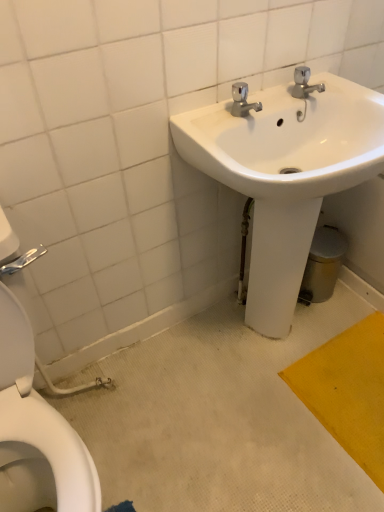
Measure the distance between white glossy sink at upper right and camera.

They are 34.95 inches apart.

This screenshot has height=512, width=384. In order to click on white glossy sink at upper right in this screenshot , I will do `click(286, 175)`.

What do you see at coordinates (286, 175) in the screenshot?
I see `white glossy sink at upper right` at bounding box center [286, 175].

Measure the distance between point (x=65, y=471) and camera.

The distance of point (x=65, y=471) from camera is 85.40 centimeters.

The width and height of the screenshot is (384, 512). In order to click on white glossy toilet at left in this screenshot , I will do `click(36, 431)`.

Describe the element at coordinates (36, 431) in the screenshot. I see `white glossy toilet at left` at that location.

I want to click on white glossy sink at upper right, so (286, 175).

Is white glossy toilet at left to the left of white glossy sink at upper right from the viewer's perspective?

Yes.

Which object is closer to the camera, white glossy toilet at left or white glossy sink at upper right?

white glossy toilet at left is closer to the camera.

Considering the points (63, 457) and (291, 226), which point is behind, point (63, 457) or point (291, 226)?

The point (291, 226) is farther.

From the image's perspective, is white glossy toilet at left located above white glossy sink at upper right?

Actually, white glossy toilet at left appears below white glossy sink at upper right in the image.

From a real-world perspective, between white glossy toilet at left and white glossy sink at upper right, who is vertically higher?

In real-world perspective, white glossy toilet at left is above.

In terms of width, does white glossy toilet at left look wider or thinner when compared to white glossy sink at upper right?

In the image, white glossy toilet at left appears to be wider than white glossy sink at upper right.

Considering the relative sizes of white glossy toilet at left and white glossy sink at upper right in the image provided, is white glossy toilet at left taller than white glossy sink at upper right?

Correct, white glossy toilet at left is much taller as white glossy sink at upper right.

Is white glossy toilet at left smaller than white glossy sink at upper right?

Yes, white glossy toilet at left is smaller than white glossy sink at upper right.

In the scene shown: Is white glossy toilet at left spatially inside white glossy sink at upper right, or outside of it?

white glossy toilet at left is outside white glossy sink at upper right.

Consider the image. Are white glossy toilet at left and white glossy sink at upper right located far from each other?

That's not correct — white glossy toilet at left is a little close to white glossy sink at upper right.

Is white glossy toilet at left facing towards white glossy sink at upper right?

No, white glossy toilet at left does not turn towards white glossy sink at upper right.

Can you tell me how much white glossy toilet at left and white glossy sink at upper right differ in facing direction?

The angular difference between white glossy toilet at left and white glossy sink at upper right is 0.386 degrees.

At what (x,y) coordinates should I click in order to perform the action: click on toilet above the white glossy sink at upper right (from a real-world perspective). Please return your answer as a coordinate pair (x, y). Image resolution: width=384 pixels, height=512 pixels. Looking at the image, I should click on (36, 431).

Considering the positions of objects white glossy sink at upper right and white glossy toilet at left in the image provided, who is more to the right, white glossy sink at upper right or white glossy toilet at left?

Positioned to the right is white glossy sink at upper right.

Is white glossy sink at upper right in front of or behind white glossy toilet at left in the image?

Visually, white glossy sink at upper right is located behind white glossy toilet at left.

Is point (382, 170) positioned after point (19, 349)?

Yes, it is behind point (19, 349).

From the image's perspective, is white glossy sink at upper right above or below white glossy toilet at left?

From the image's perspective, white glossy sink at upper right appears above white glossy toilet at left.

Based on the photo, from a real-world perspective, which object rests below the other?

white glossy sink at upper right.

Looking at their sizes, would you say white glossy sink at upper right is wider or thinner than white glossy toilet at left?

In the image, white glossy sink at upper right appears to be more narrow than white glossy toilet at left.

In the scene shown: Between white glossy sink at upper right and white glossy toilet at left, which one has less height?

With less height is white glossy sink at upper right.

Considering the relative sizes of white glossy sink at upper right and white glossy toilet at left in the image provided, is white glossy sink at upper right smaller than white glossy toilet at left?

Actually, white glossy sink at upper right might be larger than white glossy toilet at left.

Is white glossy toilet at left completely or partially inside white glossy sink at upper right?

No, white glossy toilet at left is not a part of white glossy sink at upper right.

Is white glossy sink at upper right not close to white glossy toilet at left?

They are positioned close to each other.

Is white glossy sink at upper right oriented away from white glossy toilet at left?

white glossy sink at upper right does not have its back to white glossy toilet at left.

What's the angular difference between white glossy sink at upper right and white glossy toilet at left's facing directions?

white glossy sink at upper right and white glossy toilet at left are facing 0.386 degrees away from each other.

Identify the location of sink lying on the right of white glossy toilet at left. This screenshot has height=512, width=384. click(286, 175).

The image size is (384, 512). Find the location of `toilet lying in front of the white glossy sink at upper right`. toilet lying in front of the white glossy sink at upper right is located at coordinates (36, 431).

This screenshot has height=512, width=384. Identify the location of toilet below the white glossy sink at upper right (from the image's perspective). (36, 431).